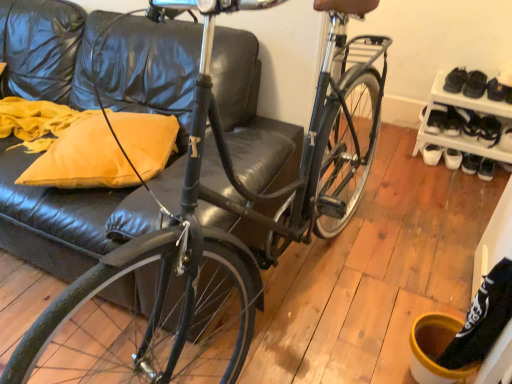
Question: Is white plastic shoe rack at lower right positioned far away from black leather shoe at right, the 1th shoe positioned from the left?

Choices:
 (A) no
 (B) yes

Answer: (A)

Question: Is white plastic shoe rack at lower right at the right side of black leather shoe at right, the 1th shoe positioned from the left?

Choices:
 (A) no
 (B) yes

Answer: (A)

Question: Is white plastic shoe rack at lower right oriented away from black leather shoe at right, the 1th shoe positioned from the left?

Choices:
 (A) yes
 (B) no

Answer: (A)

Question: Is white plastic shoe rack at lower right closer to the viewer compared to black leather shoe at right, the 2th shoe in the right-to-left sequence?

Choices:
 (A) no
 (B) yes

Answer: (B)

Question: From a real-world perspective, is white plastic shoe rack at lower right positioned under black leather shoe at right, the 1th shoe positioned from the left, based on gravity?

Choices:
 (A) no
 (B) yes

Answer: (A)

Question: Is black leather shoe at right, the second shoe when ordered from left to right, to the left or to the right of yellow fabric pillow at left in the image?

Choices:
 (A) right
 (B) left

Answer: (A)

Question: Relative to yellow fabric pillow at left, is black leather shoe at right, the second shoe when ordered from left to right, in front or behind?

Choices:
 (A) front
 (B) behind

Answer: (B)

Question: In terms of size, does black leather shoe at right, the second shoe when ordered from left to right, appear bigger or smaller than yellow fabric pillow at left?

Choices:
 (A) big
 (B) small

Answer: (B)

Question: From the image's perspective, is black leather shoe at right, the second shoe when ordered from left to right, positioned above or below yellow fabric pillow at left?

Choices:
 (A) below
 (B) above

Answer: (B)

Question: Considering the relative positions of white plastic shoe rack at lower right and yellow fabric pillow at left in the image provided, is white plastic shoe rack at lower right to the left or to the right of yellow fabric pillow at left?

Choices:
 (A) left
 (B) right

Answer: (B)

Question: Is point (506, 109) positioned closer to the camera than point (82, 137)?

Choices:
 (A) farther
 (B) closer

Answer: (A)

Question: From a real-world perspective, is white plastic shoe rack at lower right physically located above or below yellow fabric pillow at left?

Choices:
 (A) above
 (B) below

Answer: (B)

Question: In terms of width, does white plastic shoe rack at lower right look wider or thinner when compared to yellow fabric pillow at left?

Choices:
 (A) wide
 (B) thin

Answer: (B)

Question: Is yellow fabric pillow at left situated inside white plastic shoe rack at lower right or outside?

Choices:
 (A) inside
 (B) outside

Answer: (B)

Question: In terms of size, does yellow fabric pillow at left appear bigger or smaller than white plastic shoe rack at lower right?

Choices:
 (A) small
 (B) big

Answer: (A)